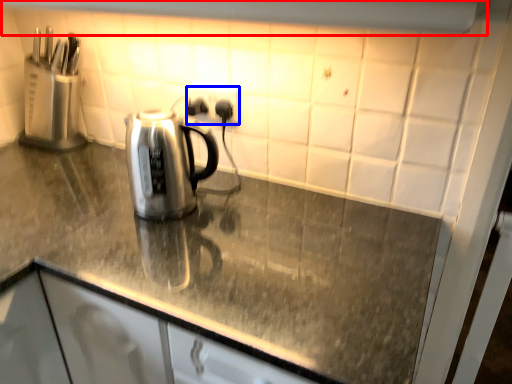
Question: Which object appears closest to the camera in this image, exhaust hood (highlighted by a red box) or electric outlet (highlighted by a blue box)?

Choices:
 (A) exhaust hood
 (B) electric outlet

Answer: (A)